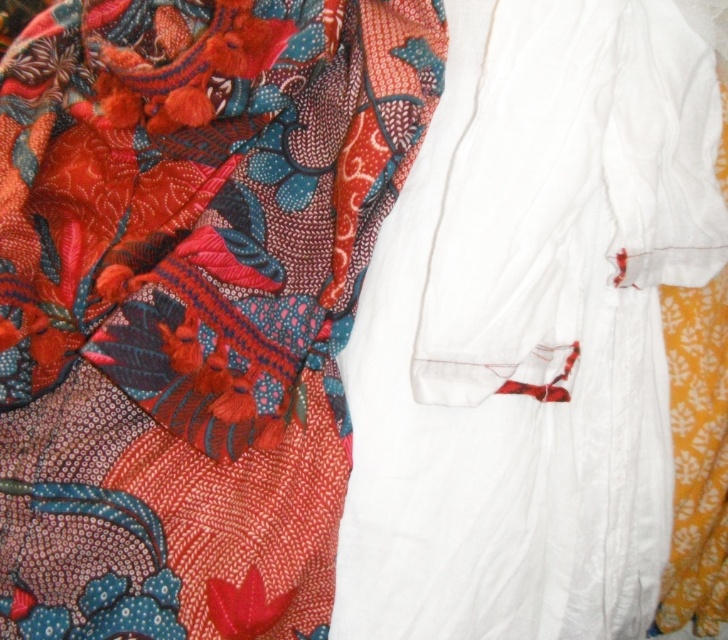
You are organizing a fashion show and need to arrange the white cotton robe at center and the floral silk scarf at upper left. According to the image, which item is closer to the front where the model will stand?

The white cotton robe at center is in front of the floral silk scarf at upper left, so the white cotton robe at center is closer to the front where the model will stand.

You are organizing a clothing inventory and need to locate the white cotton robe at center. According to the coordinates provided, where would you find it?

The white cotton robe at center is located at point (529, 330).